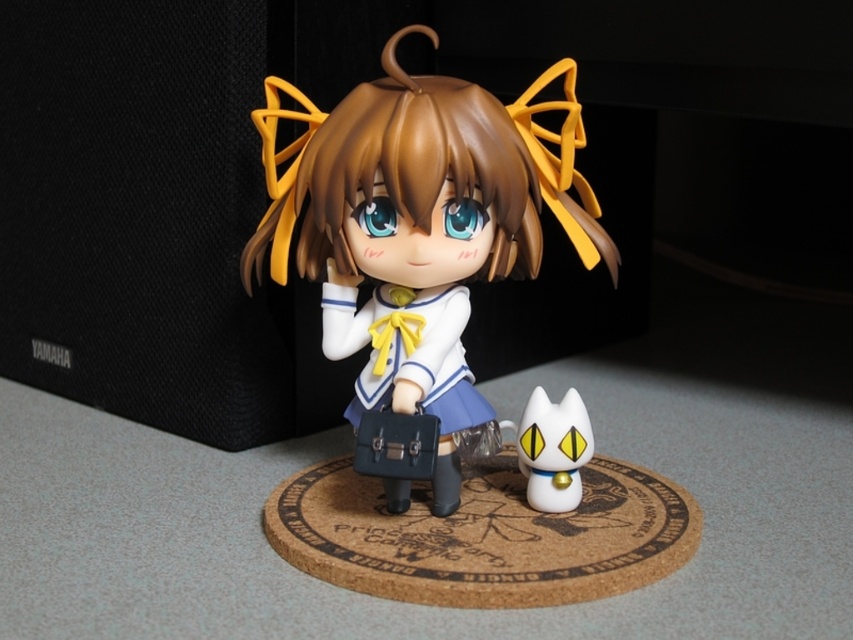
Is satin white doll at center wider than white glossy cat at lower right?

Correct, the width of satin white doll at center exceeds that of white glossy cat at lower right.

Which is in front, point (463, 372) or point (577, 396)?

Point (577, 396) is in front.

Is point (314, 163) positioned behind point (544, 436)?

No.

Where is `satin white doll at center`? This screenshot has width=853, height=640. satin white doll at center is located at coordinates (421, 230).